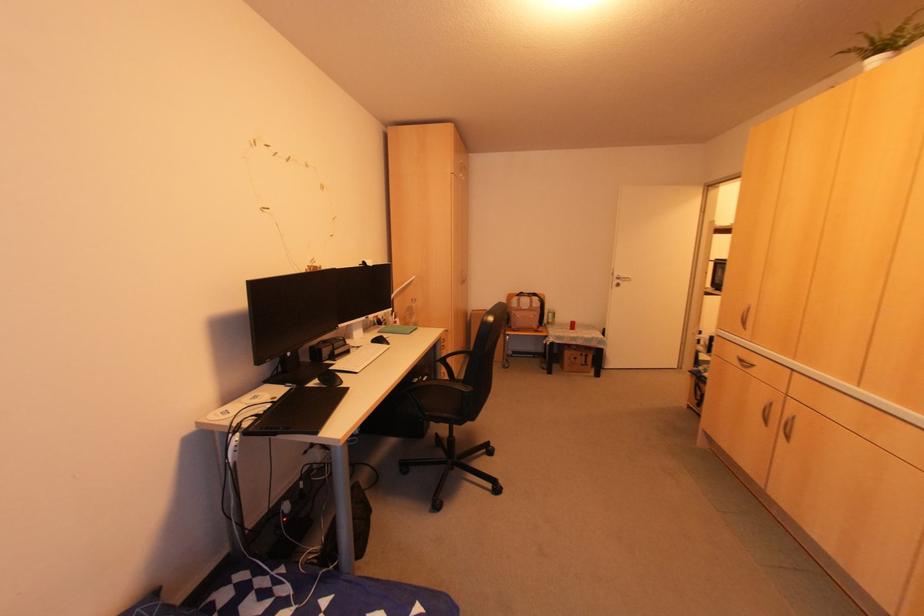
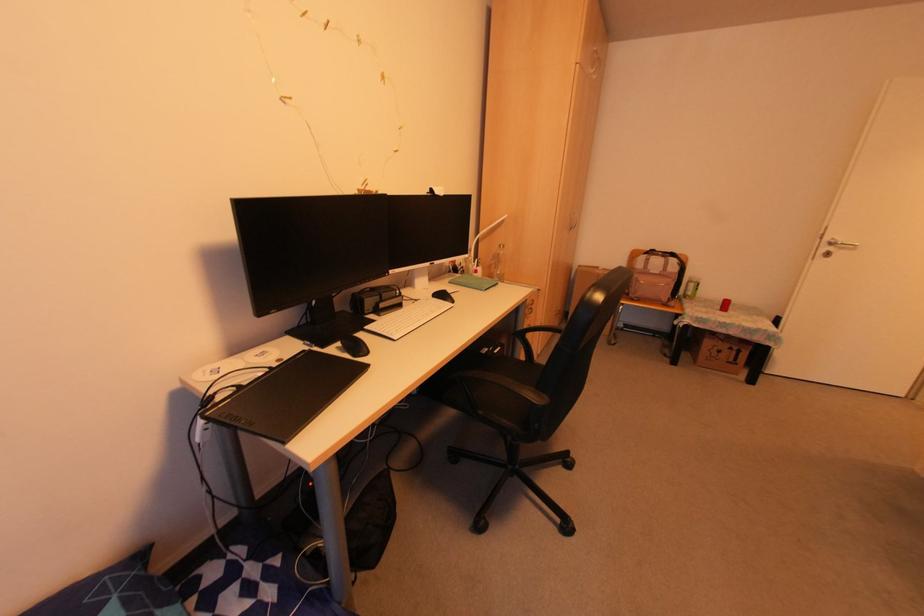
In the second image, find the point that corresponds to [615,285] in the first image.

(825, 254)